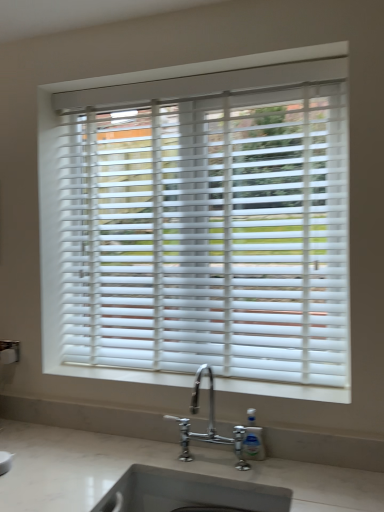
Locate an element on the screen. Image resolution: width=384 pixels, height=512 pixels. vacant space situated on the left part of clear plastic soap dispenser at lower center is located at coordinates (212, 462).